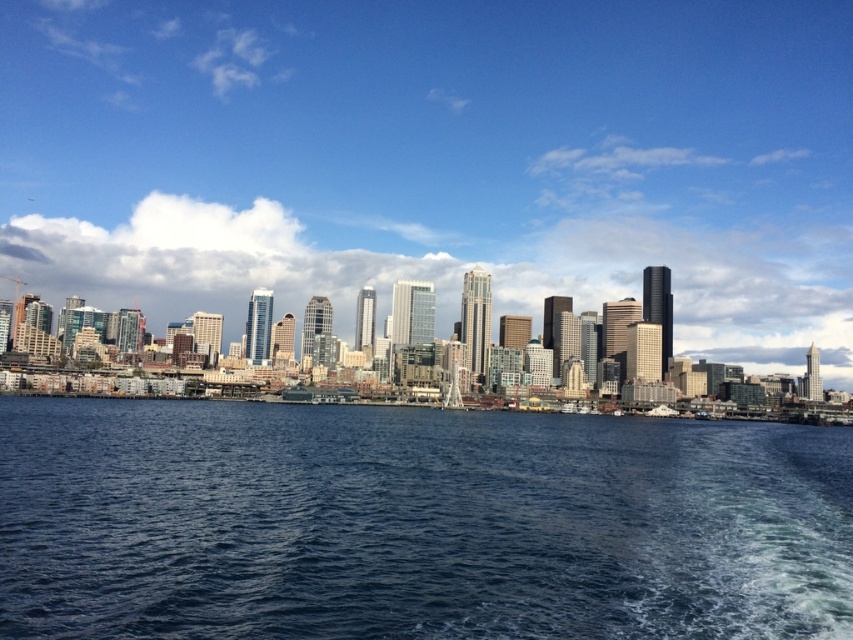
Question: Among these points, which one is nearest to the camera?

Choices:
 (A) (471, 624)
 (B) (637, 273)

Answer: (A)

Question: Among these points, which one is nearest to the camera?

Choices:
 (A) (816, 33)
 (B) (331, 448)

Answer: (B)

Question: Which point is farther to the camera?

Choices:
 (A) transparent glass skyscrapers at center
 (B) blue water at center

Answer: (A)

Question: Is transparent glass skyscrapers at center further to camera compared to blue water at center?

Choices:
 (A) no
 (B) yes

Answer: (B)

Question: Does transparent glass skyscrapers at center have a greater width compared to blue water at center?

Choices:
 (A) yes
 (B) no

Answer: (A)

Question: Does transparent glass skyscrapers at center appear on the left side of blue water at center?

Choices:
 (A) no
 (B) yes

Answer: (B)